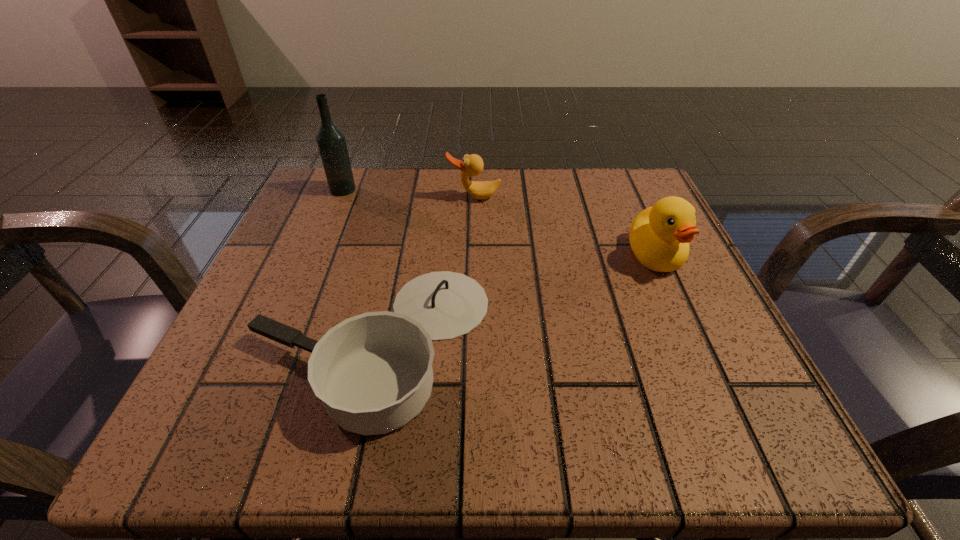
This screenshot has width=960, height=540. Identify the location of blank region between the vodka and the shorter duck. (408, 193).

The height and width of the screenshot is (540, 960). I want to click on free spot between the taller duck and the vodka, so click(499, 222).

I want to click on vacant space that's between the saucepan and the nearer duck, so click(514, 299).

At what (x,y) coordinates should I click in order to perform the action: click on unoccupied position between the saucepan and the left duck. Please return your answer as a coordinate pair (x, y). Looking at the image, I should click on (423, 270).

Find the location of `vacant point located between the nearer duck and the vodka`. vacant point located between the nearer duck and the vodka is located at coordinates (499, 222).

Identify the location of object that can be found as the closest to the nearer duck. Image resolution: width=960 pixels, height=540 pixels. (472, 165).

Identify which object is the second closest to the saucepan. Please provide its 2D coordinates. Your answer should be formatted as a tuple, i.e. [(x, y)], where the tuple contains the x and y coordinates of a point satisfying the conditions above.

[(331, 141)]